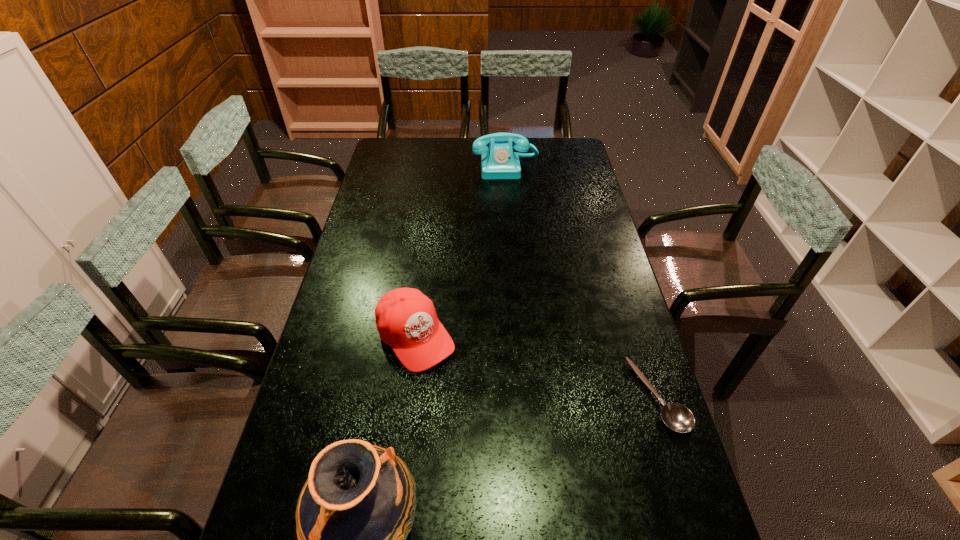
Locate an element on the screen. Image resolution: width=960 pixels, height=540 pixels. vacant space situated 0.110m on the front panel of the second shortest object is located at coordinates (461, 394).

Where is `free space located on the front panel of the second shortest object`? free space located on the front panel of the second shortest object is located at coordinates (494, 435).

At what (x,y) coordinates should I click in order to perform the action: click on object situated at the far edge. Please return your answer as a coordinate pair (x, y). Image resolution: width=960 pixels, height=540 pixels. Looking at the image, I should click on (499, 161).

At what (x,y) coordinates should I click in order to perform the action: click on object that is at the left edge. Please return your answer as a coordinate pair (x, y). The image size is (960, 540). Looking at the image, I should click on (406, 319).

Locate an element on the screen. object located at the right edge is located at coordinates (677, 417).

This screenshot has height=540, width=960. I want to click on free space at the far edge of the desktop, so click(x=542, y=150).

This screenshot has height=540, width=960. Find the location of `free region at the left edge`. free region at the left edge is located at coordinates (274, 478).

In the image, there is a desktop. What are the coordinates of `free space at the right edge` in the screenshot? It's located at (587, 286).

I want to click on free point at the far left corner, so click(401, 137).

This screenshot has height=540, width=960. Identify the location of free space at the near left corner of the desktop. (295, 508).